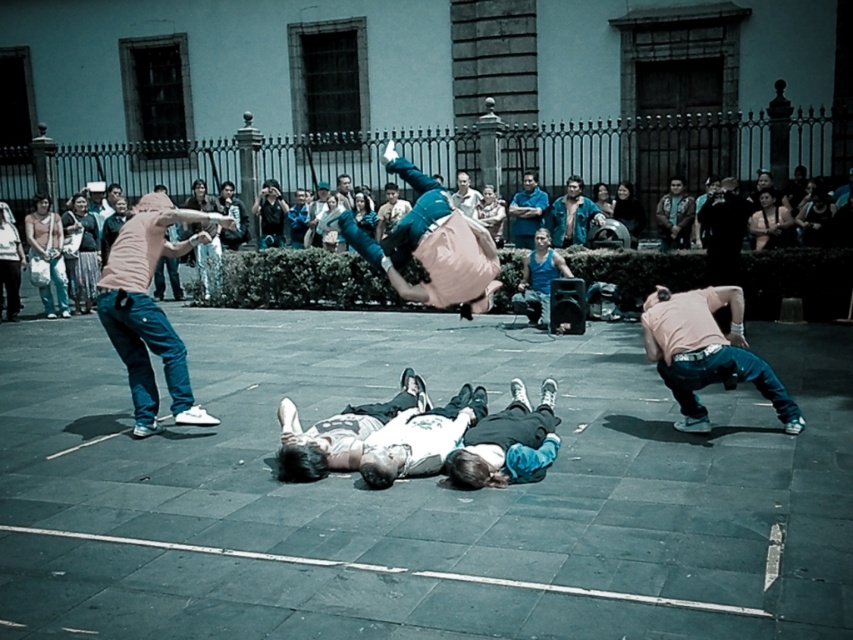
You are a photographer trying to capture a photo of the light pink hoodie at left and the denim jacket at center. Which object should you focus on first if you want to ensure both are in focus, considering their heights?

The light pink hoodie at left is taller than the denim jacket at center, so focusing on the light pink hoodie at left first would ensure both are in focus since it is the taller object.

You are a photographer positioned at the back of the square, aiming to capture a clear photo of both the light pink hoodie at left and the denim jacket at center without any obstruction. Based on their positions, which clothing item will appear closer to the camera in the final photo?

The light pink hoodie at left will appear closer to the camera in the final photo because it is positioned in front of the denim jacket at center.

You are a photographer trying to capture the street performance. You want to ensure both the light brown hair at center and the denim jacket at center are clearly visible in your photo. Based on their sizes, which object should you focus on first to ensure it stands out more in the composition?

The light brown hair at center is bigger than the denim jacket at center, so focusing on the light brown hair at center first will ensure it stands out more in the composition.